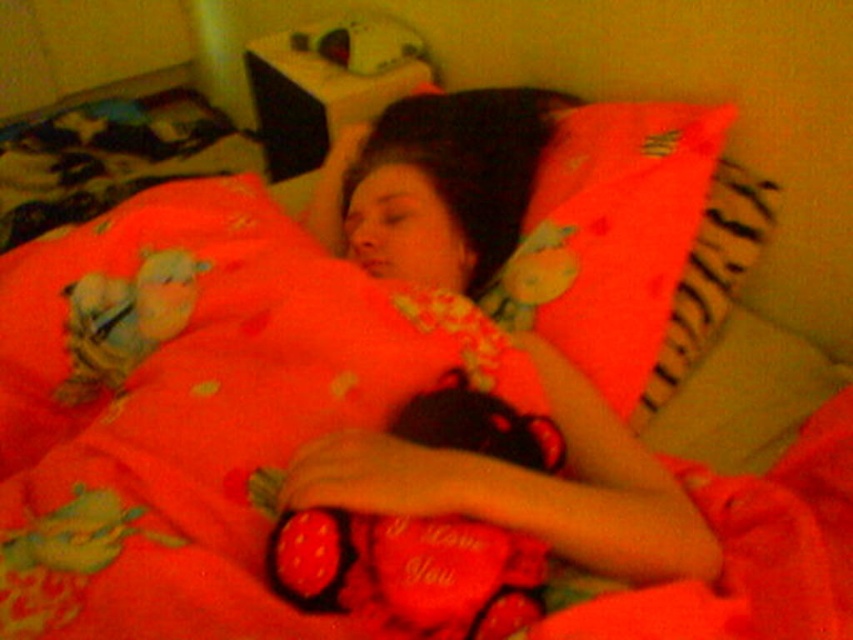
Does zebra-patterned pillow at upper right lie behind soft plush toy at upper left?

Yes, zebra-patterned pillow at upper right is behind soft plush toy at upper left.

Does point (764, 228) come in front of point (68, 388)?

No.

Find the location of a particular element. This screenshot has width=853, height=640. zebra-patterned pillow at upper right is located at coordinates (711, 276).

Can you confirm if fluffy fabric pillow at upper right is thinner than zebra-patterned pillow at upper right?

In fact, fluffy fabric pillow at upper right might be wider than zebra-patterned pillow at upper right.

Identify the location of fluffy fabric pillow at upper right. This screenshot has height=640, width=853. tap(611, 236).

Based on the photo, can you confirm if matte fabric woman at center is positioned to the left of fluffy fabric pillow at upper right?

Correct, you'll find matte fabric woman at center to the left of fluffy fabric pillow at upper right.

Is matte fabric woman at center shorter than fluffy fabric pillow at upper right?

No.

Does point (321, 492) come closer to viewer compared to point (515, 296)?

Yes, it is.

At what (x,y) coordinates should I click in order to perform the action: click on matte fabric woman at center. Please return your answer as a coordinate pair (x, y). This screenshot has width=853, height=640. Looking at the image, I should click on (529, 486).